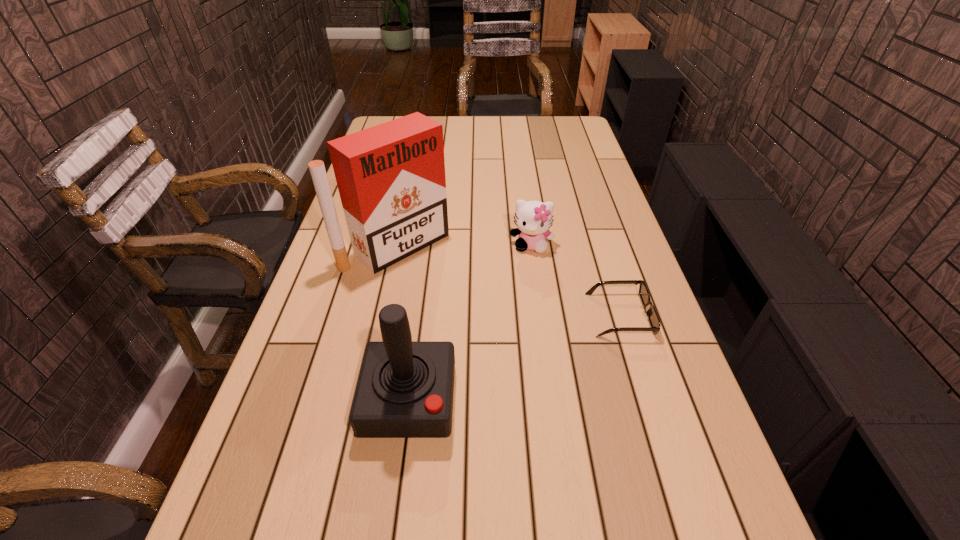
The image size is (960, 540). What are the coordinates of `vacant space situated 0.340m on the front-facing side of the third object from left to right` in the screenshot? It's located at coord(522,345).

I want to click on vacant position located 0.080m on the front-facing side of the cigarette case, so click(x=445, y=281).

Image resolution: width=960 pixels, height=540 pixels. In order to click on vacant space located 0.270m on the front-facing side of the cigarette case in this screenshot , I will do `click(492, 319)`.

Locate an element on the screen. free location located on the front-facing side of the cigarette case is located at coordinates (471, 302).

The height and width of the screenshot is (540, 960). I want to click on object that is at the left edge, so click(x=391, y=179).

Locate an element on the screen. object that is at the right edge is located at coordinates (651, 313).

In the image, there is a desktop. At what (x,y) coordinates should I click in order to perform the action: click on vacant space at the far edge. Please return your answer as a coordinate pair (x, y). The image size is (960, 540). Looking at the image, I should click on pyautogui.click(x=468, y=123).

This screenshot has width=960, height=540. In order to click on vacant region at the near edge in this screenshot , I will do `click(461, 500)`.

Find the location of a particular element. free space at the left edge of the desktop is located at coordinates (346, 299).

The width and height of the screenshot is (960, 540). Identify the location of free space at the right edge of the desktop. (571, 162).